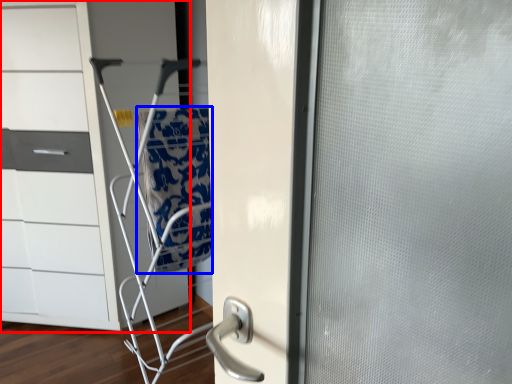
Question: Among these objects, which one is farthest to the camera, chest of drawers (highlighted by a red box) or blanket (highlighted by a blue box)?

Choices:
 (A) chest of drawers
 (B) blanket

Answer: (A)